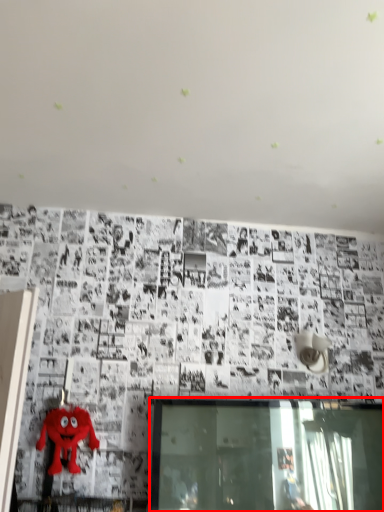
Question: Considering the relative positions of window (annotated by the red box) and toy in the image provided, where is window (annotated by the red box) located with respect to the staircase?

Choices:
 (A) left
 (B) right

Answer: (B)